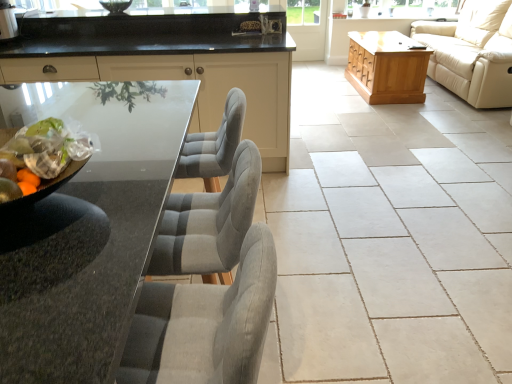
Question: Should I look upward or downward to see light brown wooden chest at right?

Choices:
 (A) up
 (B) down

Answer: (A)

Question: From the image's perspective, does light brown wooden chest at right appear lower than beige ceramic tile at center?

Choices:
 (A) no
 (B) yes

Answer: (A)

Question: From a real-world perspective, is light brown wooden chest at right physically below beige ceramic tile at center?

Choices:
 (A) no
 (B) yes

Answer: (A)

Question: Considering the relative sizes of light brown wooden chest at right and beige ceramic tile at center in the image provided, is light brown wooden chest at right smaller than beige ceramic tile at center?

Choices:
 (A) yes
 (B) no

Answer: (B)

Question: Can you confirm if light brown wooden chest at right is taller than beige ceramic tile at center?

Choices:
 (A) yes
 (B) no

Answer: (A)

Question: Is light brown wooden chest at right far from beige ceramic tile at center?

Choices:
 (A) yes
 (B) no

Answer: (A)

Question: From the image's perspective, would you say light brown wooden chest at right is positioned over beige ceramic tile at center?

Choices:
 (A) no
 (B) yes

Answer: (B)

Question: From the image's perspective, is translucent plastic bag of mixed fruits at left located beneath transparent glass screen door at center?

Choices:
 (A) no
 (B) yes

Answer: (B)

Question: From a real-world perspective, is translucent plastic bag of mixed fruits at left located higher than transparent glass screen door at center?

Choices:
 (A) yes
 (B) no

Answer: (A)

Question: Does translucent plastic bag of mixed fruits at left have a larger size compared to transparent glass screen door at center?

Choices:
 (A) yes
 (B) no

Answer: (B)

Question: Considering the relative sizes of translucent plastic bag of mixed fruits at left and transparent glass screen door at center in the image provided, is translucent plastic bag of mixed fruits at left shorter than transparent glass screen door at center?

Choices:
 (A) no
 (B) yes

Answer: (B)

Question: Does translucent plastic bag of mixed fruits at left lie in front of transparent glass screen door at center?

Choices:
 (A) no
 (B) yes

Answer: (B)

Question: Is translucent plastic bag of mixed fruits at left taller than transparent glass screen door at center?

Choices:
 (A) no
 (B) yes

Answer: (A)

Question: Is matte black cabinetry at center bigger than beige leather couch at right?

Choices:
 (A) no
 (B) yes

Answer: (A)